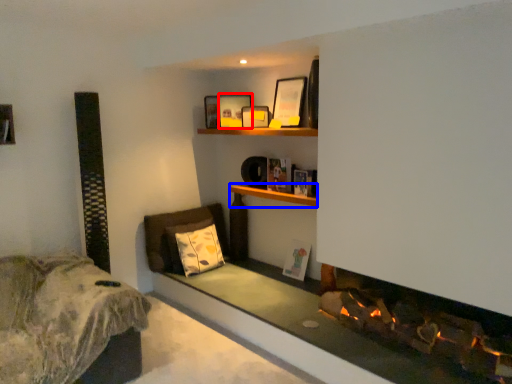
Question: Which of the following is the closest to the observer, picture frame (highlighted by a red box) or cabinet (highlighted by a blue box)?

Choices:
 (A) picture frame
 (B) cabinet

Answer: (B)